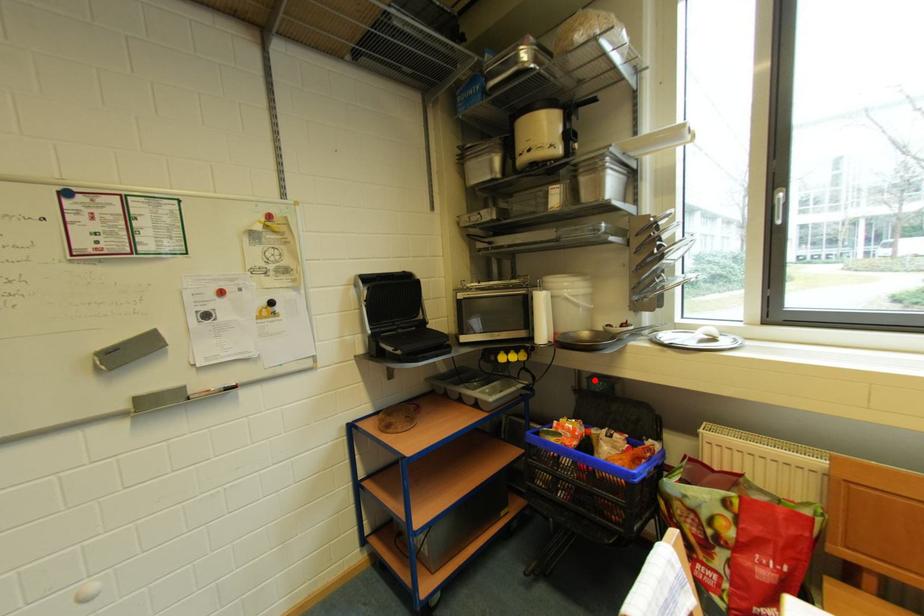
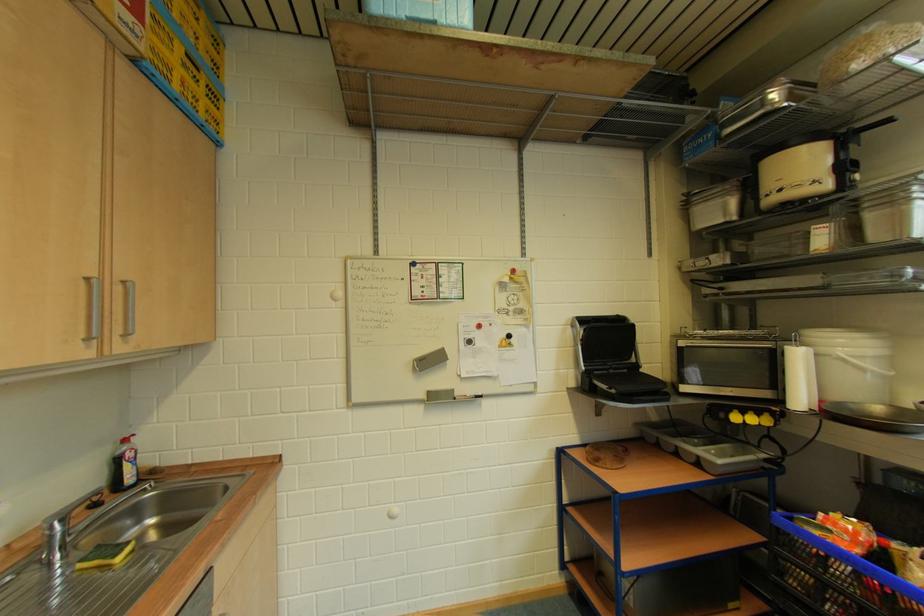
Question: I am providing you with two images of the same scene from different viewpoints. Image1 has a red point marked. In image2, the corresponding 3D location appears at what relative position? Reply with the corresponding letter.

Choices:
 (A) Closer
 (B) Farther

Answer: (A)